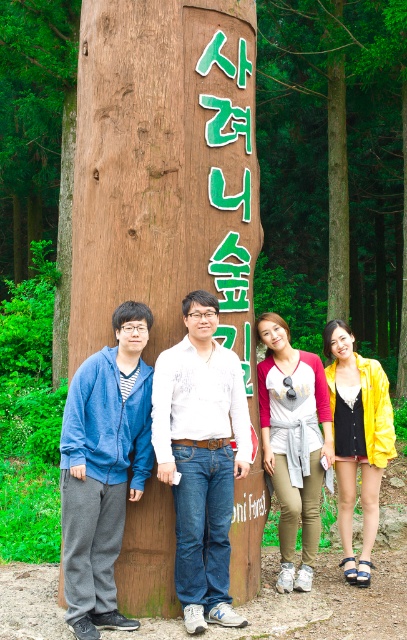
You are a photographer trying to capture a photo of the wooden signpost at center and the red and white baseball jersey at center. Since you want to ensure both are clearly visible, which object should you focus on first to account for their sizes?

The wooden signpost at center is bigger than the red and white baseball jersey at center, so you should focus on the wooden signpost at center first because it is larger and will require more attention to capture its details clearly.

You are a photographer trying to capture a group photo of the red and white baseball jersey at center and the yellow shiny jacket at lower right. Which of the two should you focus on first if you want to ensure both are in frame without moving the camera? Explain your reasoning based on their sizes.

The red and white baseball jersey at center is wider than the yellow shiny jacket at lower right. Since the jersey is wider, focusing on it first ensures that there is enough space in the frame to accommodate both subjects without needing to adjust the camera position.

You are a photographer trying to capture a clear shot of the red and white baseball jersey at center and the yellow shiny jacket at lower right. Which one will appear larger in your photo?

The red and white baseball jersey at center will appear larger in the photo because it is closer to the viewer than the yellow shiny jacket at lower right.